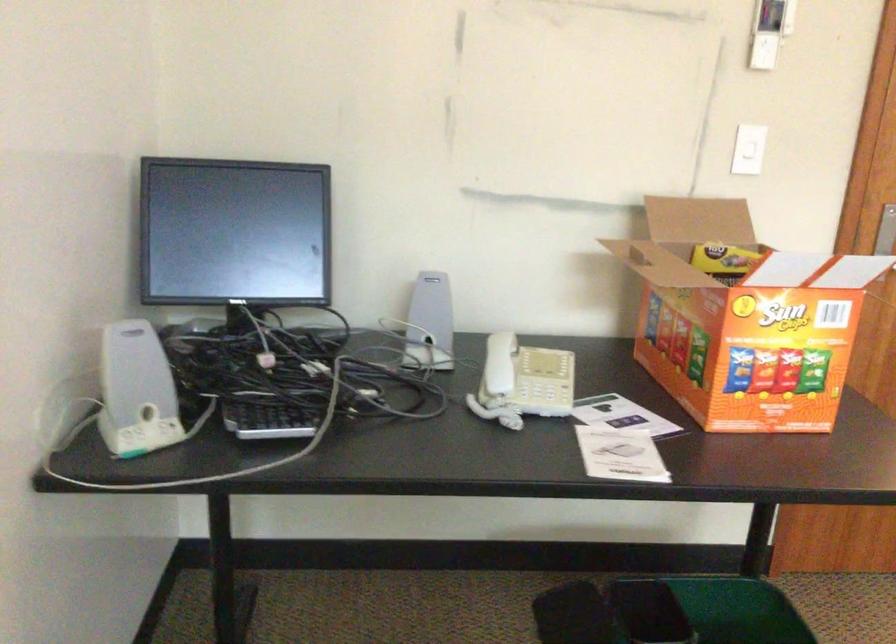
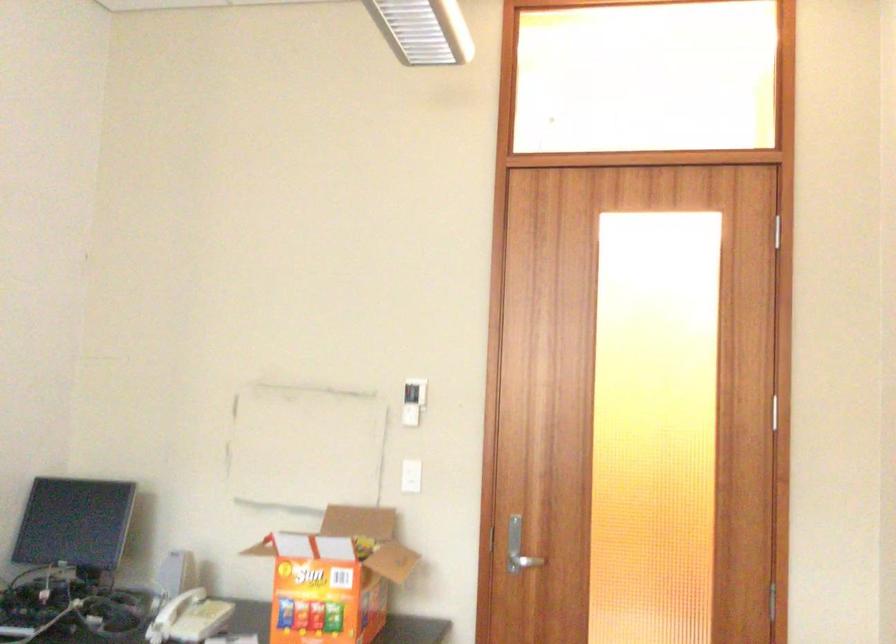
Consider the image. What movement of the cameraman would produce the second image?

The cameraman walked toward right, backward.